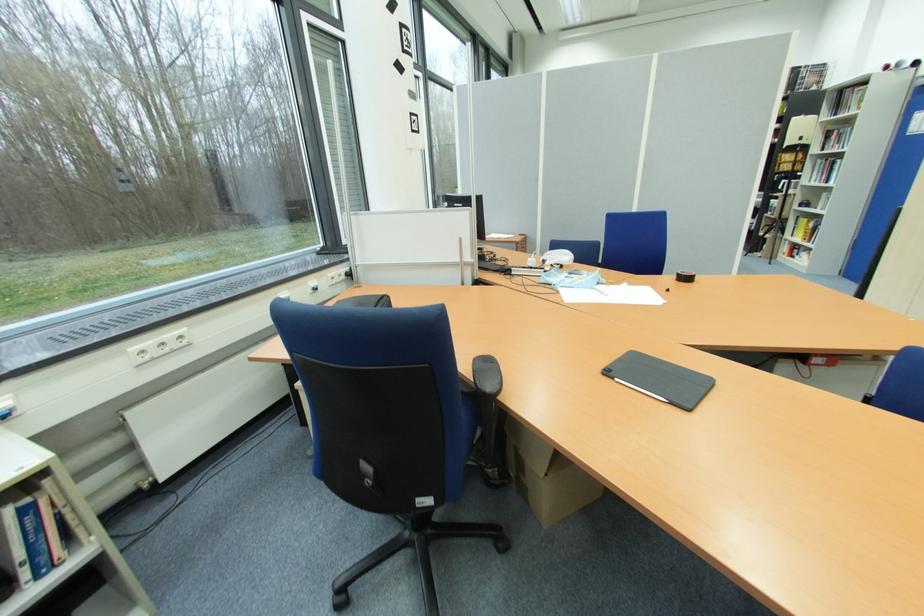
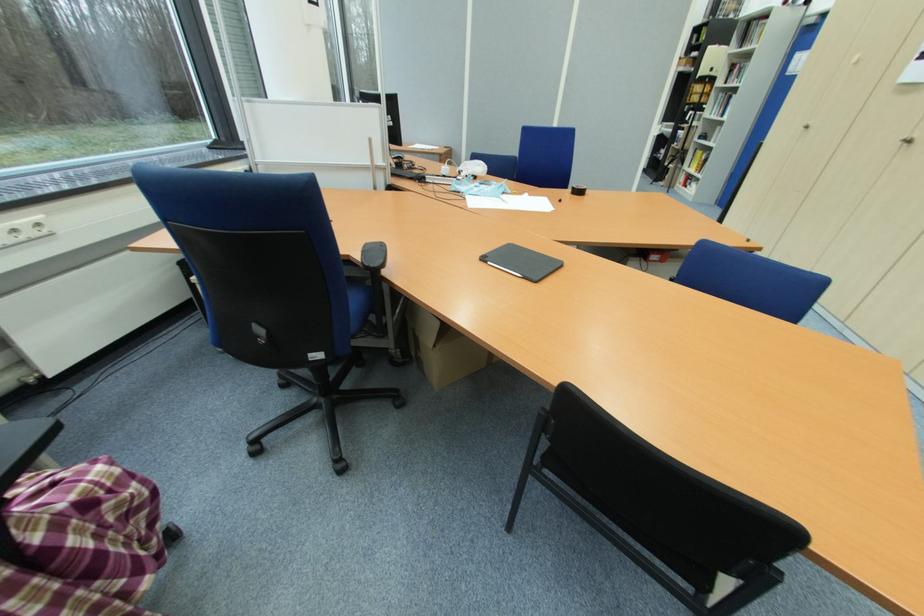
Where in the second image is the point corresponding to point (690, 280) from the first image?

(581, 193)